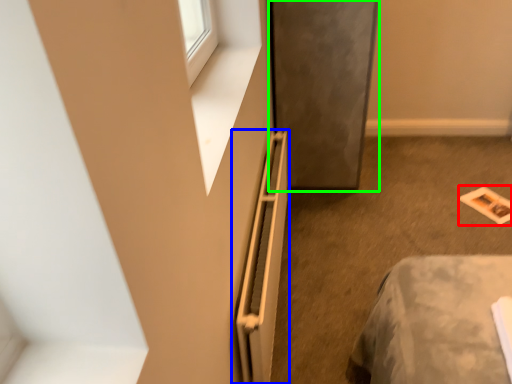
Question: Which is nearer to the magazine (highlighted by a red box)? radiator (highlighted by a blue box) or screen door (highlighted by a green box).

Choices:
 (A) radiator
 (B) screen door

Answer: (B)